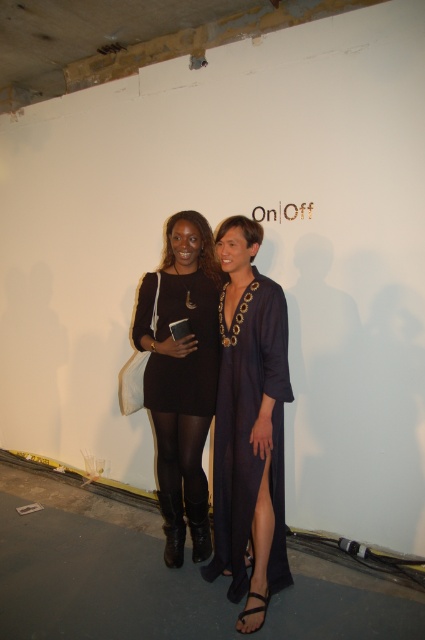
You are a photographer setting up for a photoshoot in a construction zone. You need to position a model wearing a navy satin dress at center so that they are not overlapping with the black leather boots at lower center. Based on the scene description, can you confirm if their current positions allow for this?

The navy satin dress at center is to the right of the black leather boots at lower center, so their current positions do not overlap. The photographer can proceed with the setup as described.